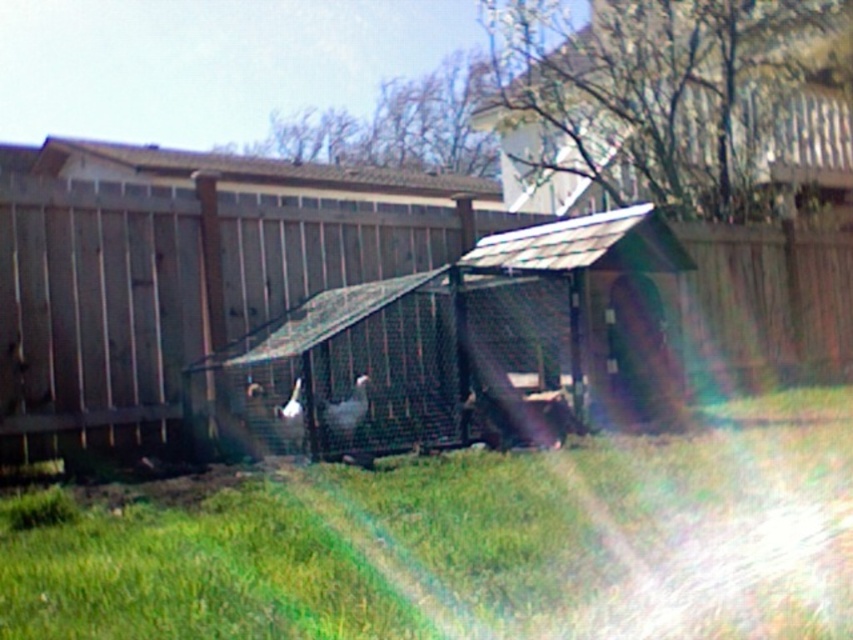
You are a gardener who wants to plant a new flower bed in the backyard. You see the green grass at center and the metallic gray hut at center. Which area has more space available for planting?

The metallic gray hut at center has a larger size compared to the green grass at center, so there is more space available around the metallic gray hut at center for planting the flower bed.